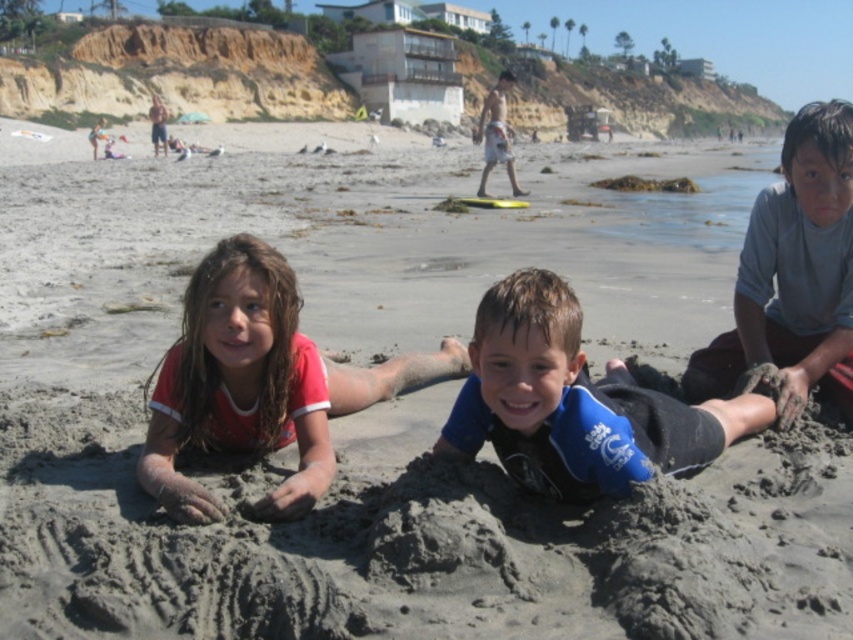
Is wet red shirt at center above blue fabric at center?

Yes.

Does wet red shirt at center appear under blue fabric at center?

Incorrect, wet red shirt at center is not positioned below blue fabric at center.

Describe the element at coordinates (259, 384) in the screenshot. I see `wet red shirt at center` at that location.

Where is `wet red shirt at center`? wet red shirt at center is located at coordinates (259, 384).

Between wet red shirt at center and gray matte shirt at center, which one appears on the right side from the viewer's perspective?

From the viewer's perspective, gray matte shirt at center appears more on the right side.

Between point (200, 372) and point (834, 200), which one is positioned in front?

Point (200, 372)

This screenshot has height=640, width=853. Identify the location of wet red shirt at center. (259, 384).

The height and width of the screenshot is (640, 853). What are the coordinates of `wet red shirt at center` in the screenshot? It's located at (259, 384).

Can you confirm if blue fabric at center is taller than gray matte shirt at center?

In fact, blue fabric at center may be shorter than gray matte shirt at center.

Who is more forward, [666,400] or [807,320]?

Positioned in front is point [666,400].

Locate an element on the screen. blue fabric at center is located at coordinates (573, 403).